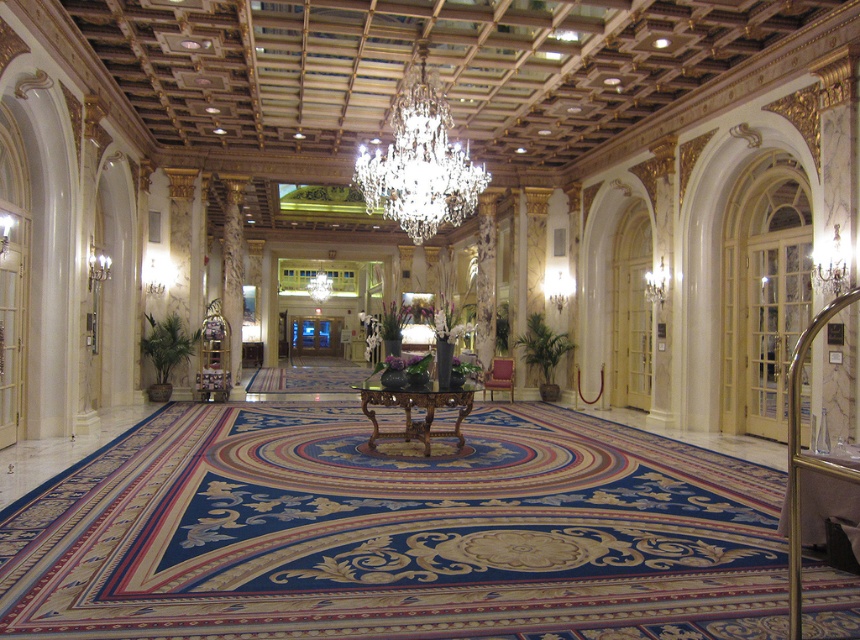
Question: Is crystal glass chandelier at center further to the viewer compared to gold metallic door at center?

Choices:
 (A) yes
 (B) no

Answer: (B)

Question: Considering the relative positions of crystal glass chandelier at center and satin burgundy chair at center in the image provided, where is crystal glass chandelier at center located with respect to satin burgundy chair at center?

Choices:
 (A) above
 (B) below

Answer: (A)

Question: Which object appears farthest from the camera in this image?

Choices:
 (A) satin burgundy chair at center
 (B) gold metallic door at center
 (C) crystal glass chandelier at center

Answer: (B)

Question: Can you confirm if gold metallic door at center is bigger than satin burgundy chair at center?

Choices:
 (A) no
 (B) yes

Answer: (A)

Question: Which point is closer to the camera?

Choices:
 (A) crystal glass chandelier at center
 (B) satin burgundy chair at center
 (C) gold metallic door at center

Answer: (A)

Question: Estimate the real-world distances between objects in this image. Which object is closer to the crystal glass chandelier at center?

Choices:
 (A) satin burgundy chair at center
 (B) gold metallic door at center

Answer: (A)